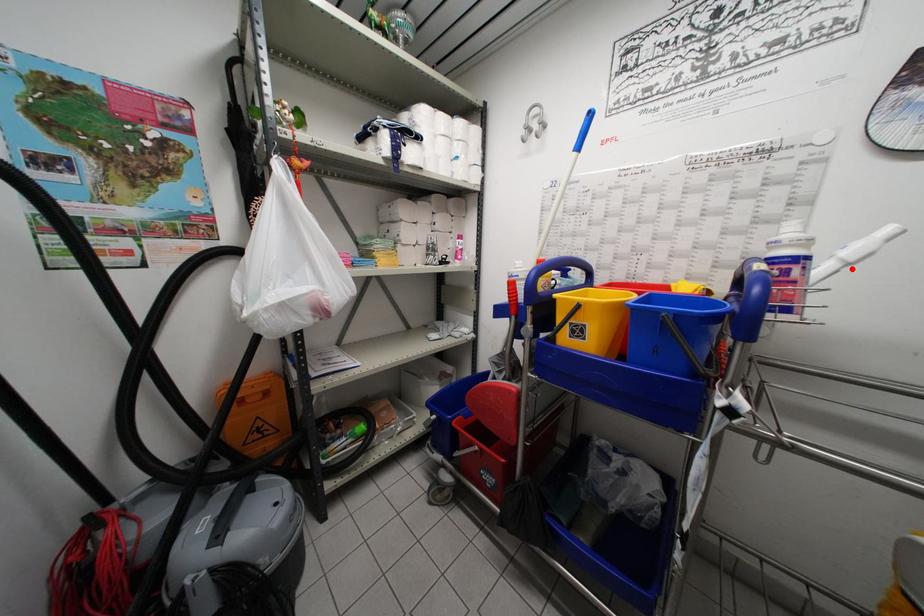
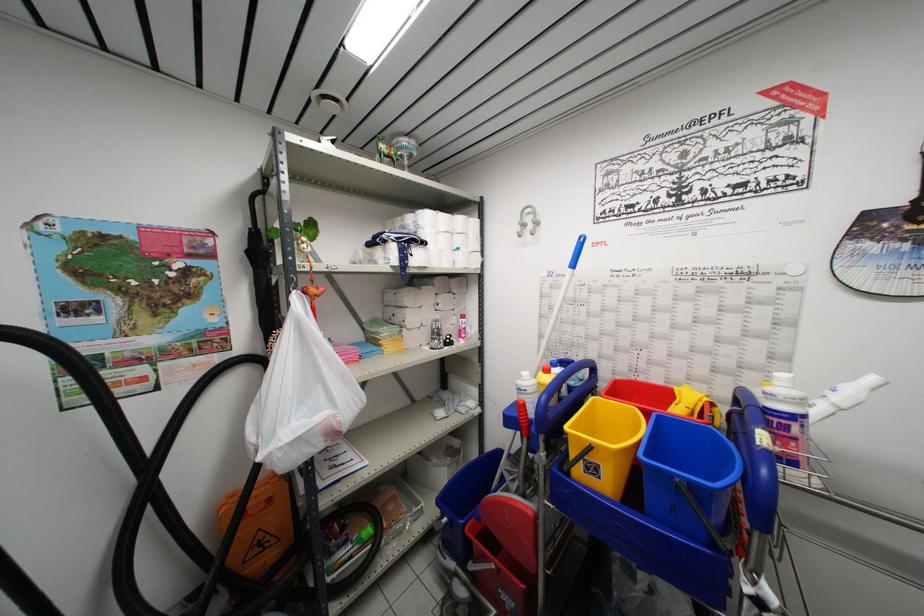
Question: I am providing you with two images of the same scene from different viewpoints. A red point is shown in image1. For the corresponding object point in image2, is it positioned nearer or farther from the camera?

Choices:
 (A) Nearer
 (B) Farther

Answer: (A)